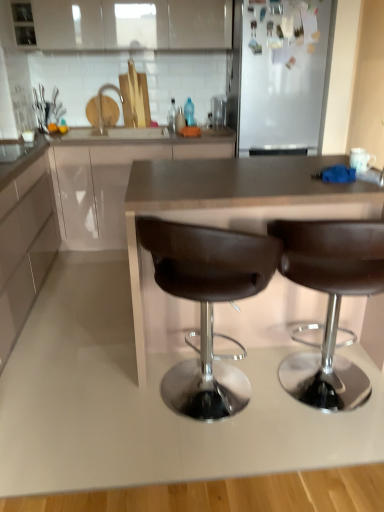
Question: Which direction should I rotate to face brown leather stool at center, acting as the 2th chair starting from the left, — up or down?

Choices:
 (A) up
 (B) down

Answer: (B)

Question: Is white glossy cabinet at upper center, which is the first cabinetry in top-to-bottom order, turned away from brushed metal faucet at upper center?

Choices:
 (A) yes
 (B) no

Answer: (B)

Question: Considering the relative sizes of white glossy cabinet at upper center, arranged as the 3th cabinetry when ordered from the bottom, and brushed metal faucet at upper center in the image provided, is white glossy cabinet at upper center, arranged as the 3th cabinetry when ordered from the bottom, shorter than brushed metal faucet at upper center?

Choices:
 (A) no
 (B) yes

Answer: (A)

Question: Does white glossy cabinet at upper center, which is the first cabinetry in top-to-bottom order, lie behind brushed metal faucet at upper center?

Choices:
 (A) no
 (B) yes

Answer: (A)

Question: From a real-world perspective, does white glossy cabinet at upper center, arranged as the 3th cabinetry when ordered from the bottom, stand above brushed metal faucet at upper center?

Choices:
 (A) yes
 (B) no

Answer: (A)

Question: Is white glossy cabinet at upper center, which is the first cabinetry in top-to-bottom order, bigger than brushed metal faucet at upper center?

Choices:
 (A) no
 (B) yes

Answer: (B)

Question: From the image's perspective, is white glossy cabinet at upper center, arranged as the 3th cabinetry when ordered from the bottom, on brushed metal faucet at upper center?

Choices:
 (A) no
 (B) yes

Answer: (B)

Question: Is matte white cabinet at center, positioned as the 2th cabinetry in bottom-to-top order, positioned behind white glossy cabinet at left, acting as the 1th cabinetry starting from the bottom?

Choices:
 (A) yes
 (B) no

Answer: (A)

Question: Is matte white cabinet at center, placed as the 2th cabinetry when sorted from top to bottom, positioned beyond the bounds of white glossy cabinet at left, positioned as the 3th cabinetry in top-to-bottom order?

Choices:
 (A) no
 (B) yes

Answer: (B)

Question: Considering the relative sizes of matte white cabinet at center, positioned as the 2th cabinetry in bottom-to-top order, and white glossy cabinet at left, acting as the 1th cabinetry starting from the bottom, in the image provided, is matte white cabinet at center, positioned as the 2th cabinetry in bottom-to-top order, shorter than white glossy cabinet at left, acting as the 1th cabinetry starting from the bottom,?

Choices:
 (A) no
 (B) yes

Answer: (A)

Question: Is matte white cabinet at center, placed as the 2th cabinetry when sorted from top to bottom, at the left side of white glossy cabinet at left, positioned as the 3th cabinetry in top-to-bottom order?

Choices:
 (A) no
 (B) yes

Answer: (A)

Question: Can you confirm if matte white cabinet at center, positioned as the 2th cabinetry in bottom-to-top order, is smaller than white glossy cabinet at left, acting as the 1th cabinetry starting from the bottom?

Choices:
 (A) yes
 (B) no

Answer: (B)

Question: Is white glossy cabinet at left, positioned as the 3th cabinetry in top-to-bottom order, surrounded by matte white cabinet at center, placed as the 2th cabinetry when sorted from top to bottom?

Choices:
 (A) yes
 (B) no

Answer: (A)

Question: Is matte white cabinet at center, placed as the 2th cabinetry when sorted from top to bottom, bigger than brown leather countertop at center?

Choices:
 (A) no
 (B) yes

Answer: (B)